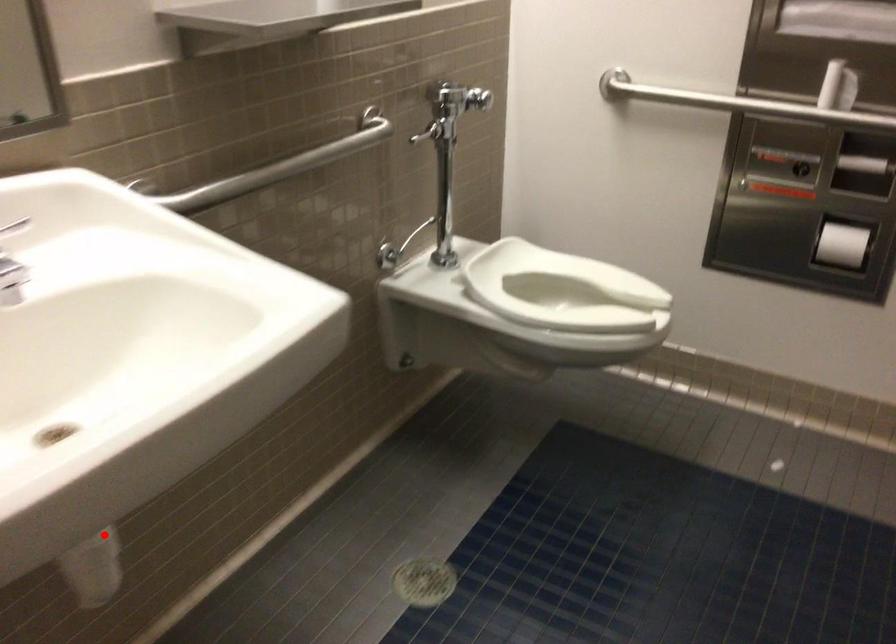
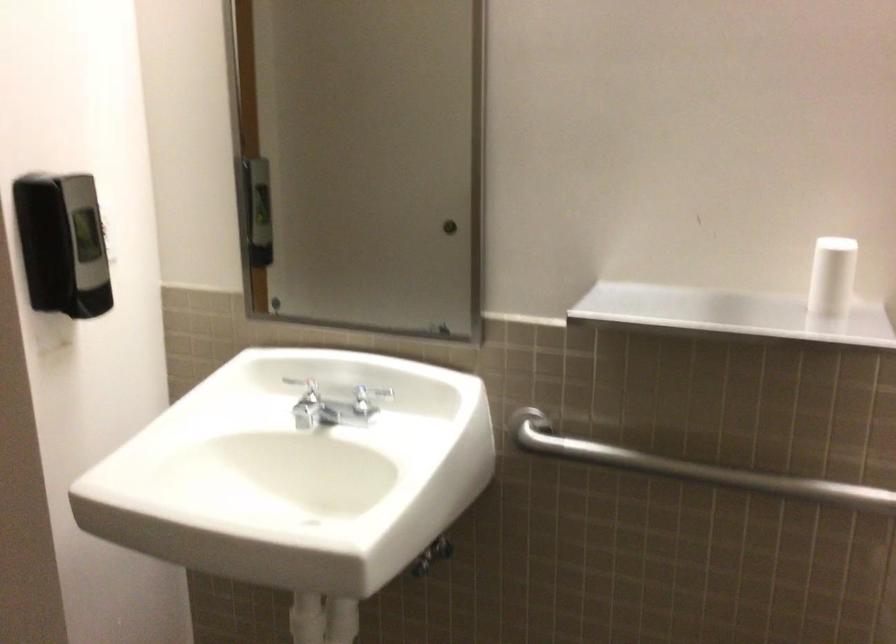
Question: I am providing you with two images of the same scene from different viewpoints. In image1, a red point is highlighted. Considering the same 3D point in image2, which of the following is correct?

Choices:
 (A) It is closer
 (B) It is farther

Answer: (B)